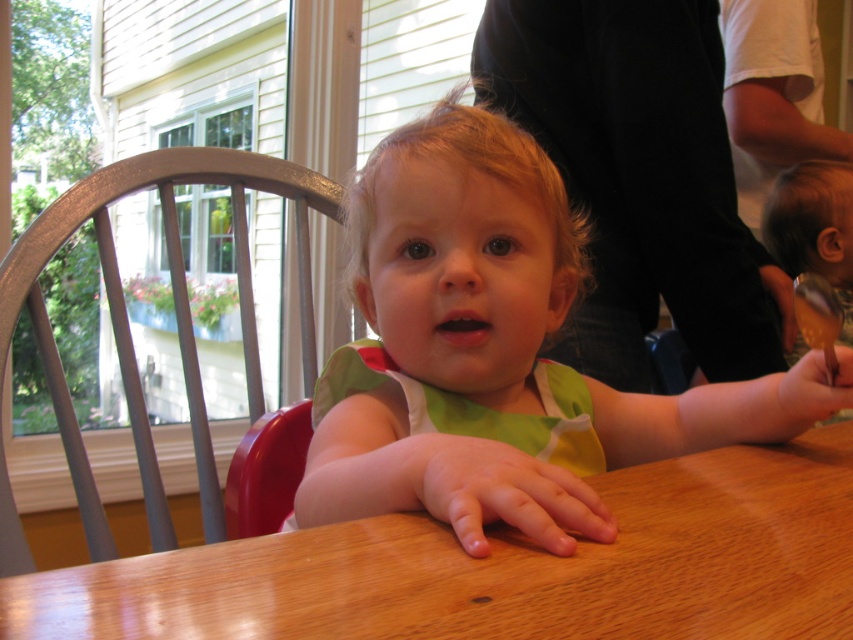
Does green cotton bib at center appear under smooth wooden spoon at lower right?

Incorrect, green cotton bib at center is not positioned below smooth wooden spoon at lower right.

What do you see at coordinates (496, 353) in the screenshot? The height and width of the screenshot is (640, 853). I see `green cotton bib at center` at bounding box center [496, 353].

You are a GUI agent. You are given a task and a screenshot of the screen. Output one action in this format:
    pyautogui.click(x=<x>, y=<y>)
    Task: Click on the green cotton bib at center
    This screenshot has width=853, height=640.
    Given the screenshot: What is the action you would take?
    pos(496,353)

Is metallic silver chair at center closer to the viewer compared to smooth brown spoon at right?

Yes.

Which of these two, metallic silver chair at center or smooth brown spoon at right, stands shorter?

Standing shorter between the two is metallic silver chair at center.

Between point (254, 332) and point (802, 346), which one is positioned behind?

Point (802, 346)

The image size is (853, 640). I want to click on metallic silver chair at center, so click(129, 330).

Between wooden table at center and metallic silver chair at center, which one appears on the right side from the viewer's perspective?

From the viewer's perspective, wooden table at center appears more on the right side.

Is wooden table at center positioned before metallic silver chair at center?

Yes.

Measure the distance between point [814,576] and camera.

Point [814,576] and camera are 40.28 centimeters apart.

Identify the location of wooden table at center. Image resolution: width=853 pixels, height=640 pixels. (505, 566).